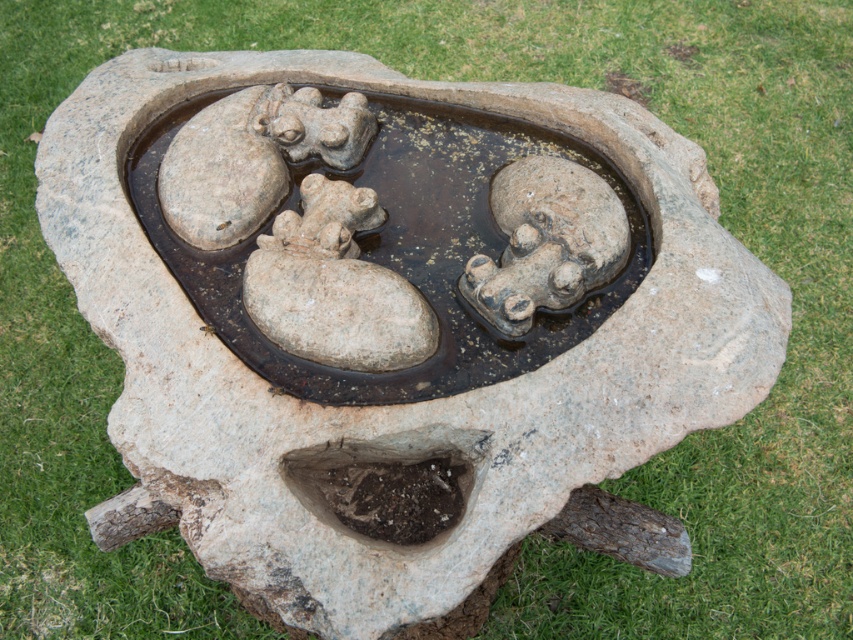
Question: Which object appears closest to the camera in this image?

Choices:
 (A) gray stone frog at upper center
 (B) smooth stone frog at center
 (C) rough stone frog at center

Answer: (C)

Question: Considering the relative positions of rough stone frog at center and gray stone frog at upper center in the image provided, where is rough stone frog at center located with respect to gray stone frog at upper center?

Choices:
 (A) left
 (B) right

Answer: (B)

Question: Can you confirm if gray stone frog at upper center is smaller than smooth stone frog at center?

Choices:
 (A) no
 (B) yes

Answer: (B)

Question: Which of the following is the farthest from the observer?

Choices:
 (A) gray stone frog at upper center
 (B) rough stone frog at center

Answer: (A)

Question: Can you confirm if rough stone frog at center is positioned to the left of gray stone frog at upper center?

Choices:
 (A) no
 (B) yes

Answer: (A)

Question: Which object is positioned closest to the rough stone frog at center?

Choices:
 (A) smooth stone frog at center
 (B) gray stone frog at upper center

Answer: (A)